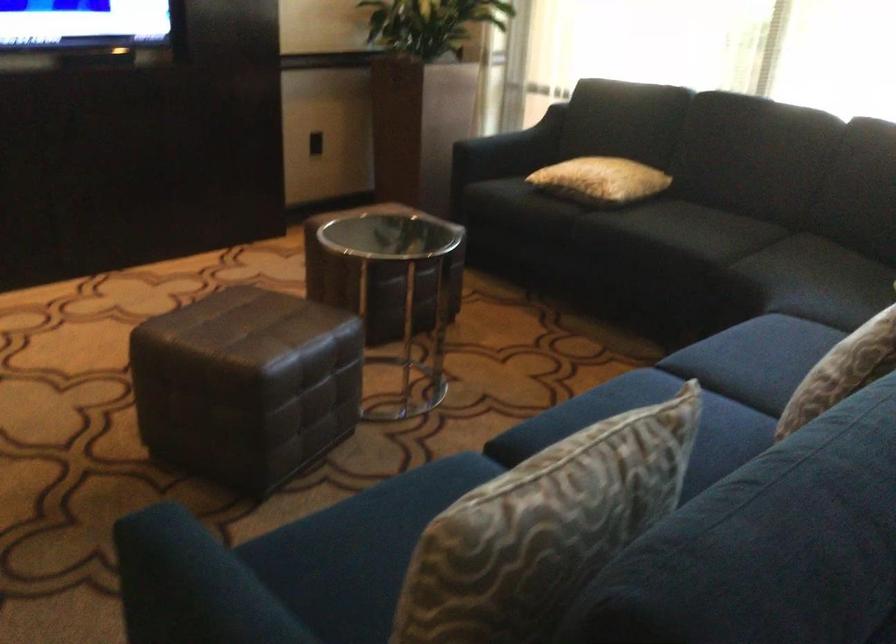
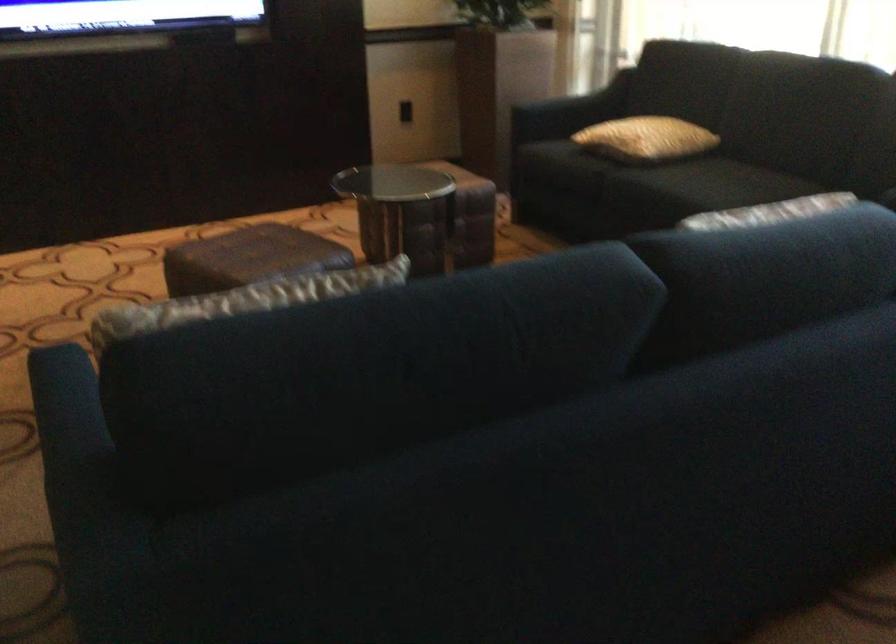
Where in the second image is the point corresponding to point 243,332 from the first image?

(248, 258)